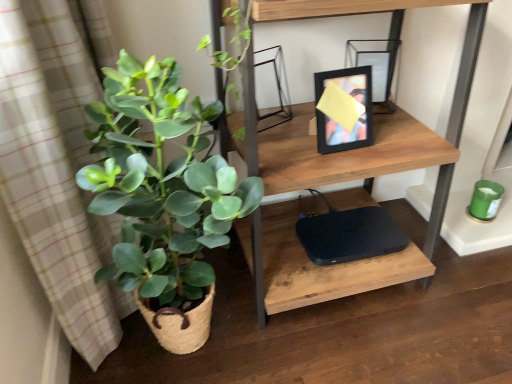
Locate an element on the screen. free space to the right of wooden shelf at upper center is located at coordinates (460, 288).